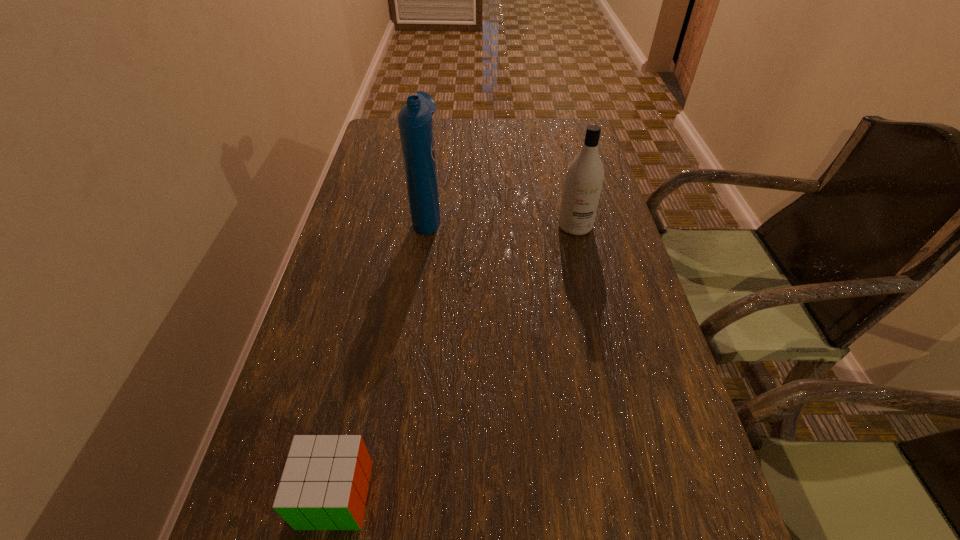
Image resolution: width=960 pixels, height=540 pixels. What are the coordinates of `vacant space that is in between the rightmost object and the cube` in the screenshot? It's located at (455, 360).

Where is `blank region between the rightmost object and the nearest object`? The height and width of the screenshot is (540, 960). blank region between the rightmost object and the nearest object is located at coordinates (455, 360).

You are a GUI agent. You are given a task and a screenshot of the screen. Output one action in this format:
    pyautogui.click(x=<x>, y=<y>)
    Task: Click on the vacant region between the nearest object and the rightmost object
    
    Given the screenshot: What is the action you would take?
    pyautogui.click(x=455, y=360)

The height and width of the screenshot is (540, 960). Identify the location of object that is the second closest to the shorter shampoo. (324, 485).

The height and width of the screenshot is (540, 960). Identify the location of the closest object to the cube. (415, 121).

I want to click on vacant position in the image that satisfies the following two spatial constraints: 1. on the back side of the taller shampoo; 2. on the right side of the cube, so click(x=396, y=213).